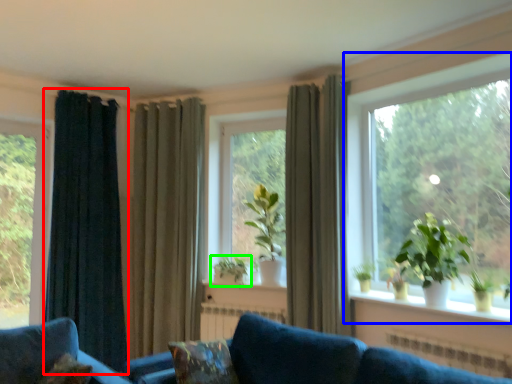
Question: Based on their relative distances, which object is nearer to curtain (highlighted by a red box)? Choose from window (highlighted by a blue box) and houseplant (highlighted by a green box).

Choices:
 (A) window
 (B) houseplant

Answer: (B)